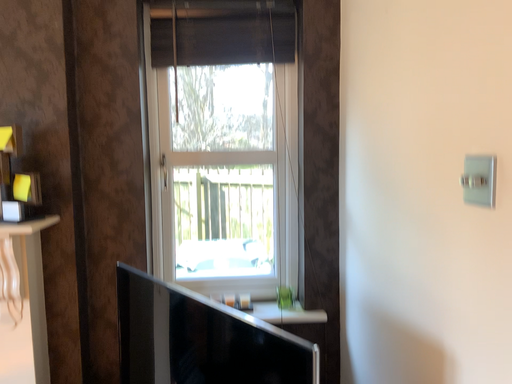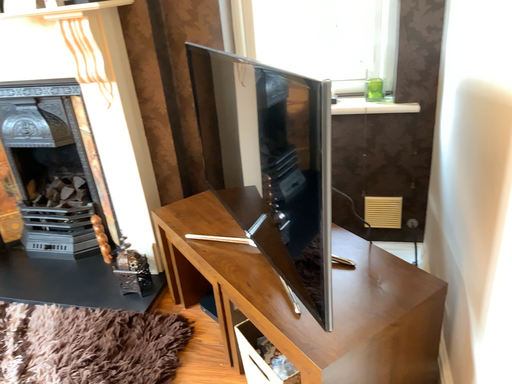
Question: How did the camera likely rotate when shooting the video?

Choices:
 (A) rotated upward
 (B) rotated downward

Answer: (B)